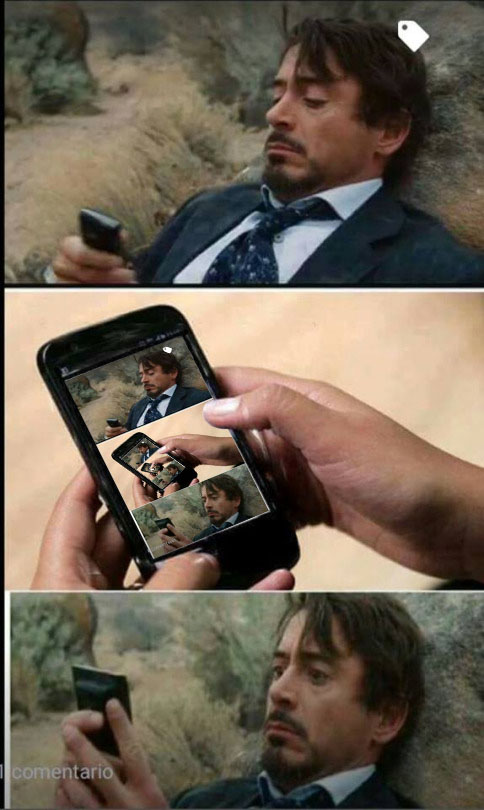
Where is `phone screen`? phone screen is located at coordinates (141, 455).